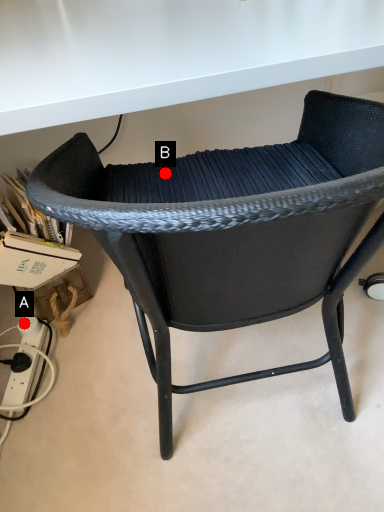
Question: Two points are circled on the image, labeled by A and B beside each circle. Which point appears farthest from the camera in this image?

Choices:
 (A) A is further
 (B) B is further

Answer: (A)